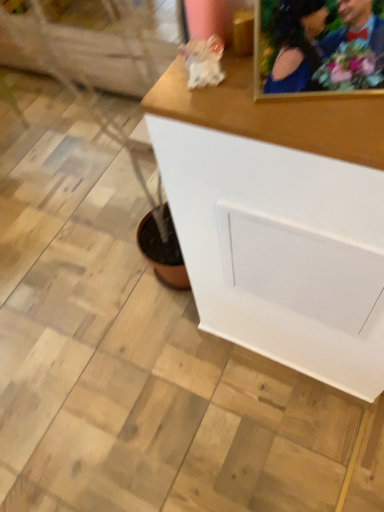
Question: Can you confirm if white matte cabinet at center is shorter than gold-framed photo at upper right?

Choices:
 (A) yes
 (B) no

Answer: (B)

Question: Does white matte cabinet at center have a larger size compared to gold-framed photo at upper right?

Choices:
 (A) yes
 (B) no

Answer: (A)

Question: Is white matte cabinet at center wider than gold-framed photo at upper right?

Choices:
 (A) no
 (B) yes

Answer: (B)

Question: Is white matte cabinet at center smaller than gold-framed photo at upper right?

Choices:
 (A) yes
 (B) no

Answer: (B)

Question: Is white matte cabinet at center thinner than gold-framed photo at upper right?

Choices:
 (A) yes
 (B) no

Answer: (B)

Question: Is white matte cabinet at center taller than gold-framed photo at upper right?

Choices:
 (A) yes
 (B) no

Answer: (A)

Question: Is gold-framed photo at upper right in contact with white matte cabinet at center?

Choices:
 (A) yes
 (B) no

Answer: (B)

Question: From a real-world perspective, is gold-framed photo at upper right located beneath white matte cabinet at center?

Choices:
 (A) no
 (B) yes

Answer: (A)

Question: Is gold-framed photo at upper right positioned far away from white matte cabinet at center?

Choices:
 (A) no
 (B) yes

Answer: (A)

Question: Is gold-framed photo at upper right bigger than white matte cabinet at center?

Choices:
 (A) no
 (B) yes

Answer: (A)

Question: Could you tell me if gold-framed photo at upper right is turned towards white matte cabinet at center?

Choices:
 (A) no
 (B) yes

Answer: (A)

Question: Is gold-framed photo at upper right completely or partially outside of white matte cabinet at center?

Choices:
 (A) yes
 (B) no

Answer: (A)

Question: Choose the correct answer: Is white matte cabinet at center inside gold-framed photo at upper right or outside it?

Choices:
 (A) inside
 (B) outside

Answer: (B)